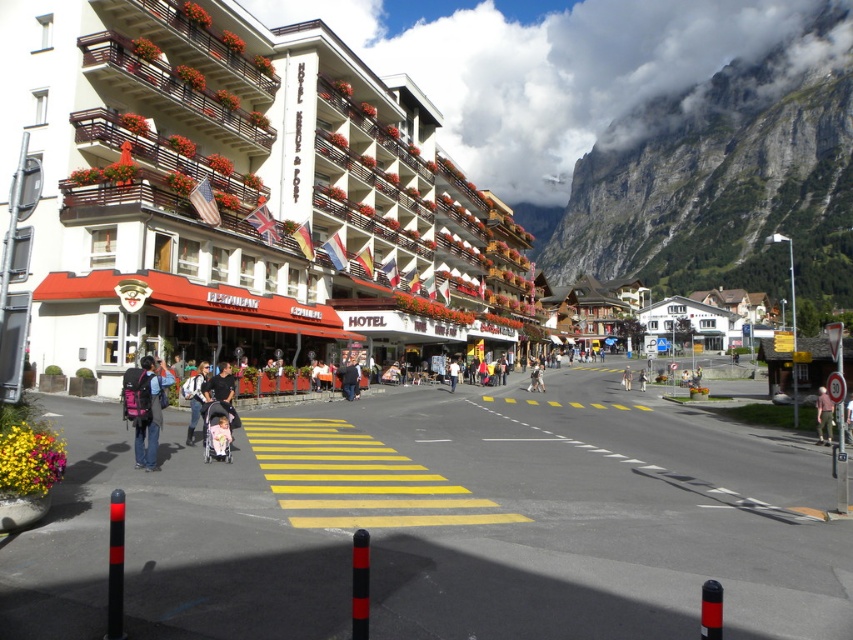
Question: Is the position of rugged stone mountain at upper right more distant than that of matte black stroller at center?

Choices:
 (A) no
 (B) yes

Answer: (B)

Question: Estimate the real-world distances between objects in this image. Which object is farther from the matte black stroller at center?

Choices:
 (A) dark blue jacket at center
 (B) matte white building at center
 (C) light brown leather jacket at center
 (D) pink backpack at lower left

Answer: (B)

Question: Which object appears closest to the camera in this image?

Choices:
 (A) rugged stone mountain at upper right
 (B) denim jacket at lower left
 (C) matte black stroller at center

Answer: (B)

Question: Is matte white building at center thinner than pink backpack at lower left?

Choices:
 (A) yes
 (B) no

Answer: (B)

Question: Can you confirm if pink backpack at lower left is wider than black fabric stroller at center?

Choices:
 (A) no
 (B) yes

Answer: (A)

Question: Which of the following is the closest to the observer?

Choices:
 (A) (158, 422)
 (B) (821, 428)
 (C) (430, 202)
 (D) (846, 406)

Answer: (A)